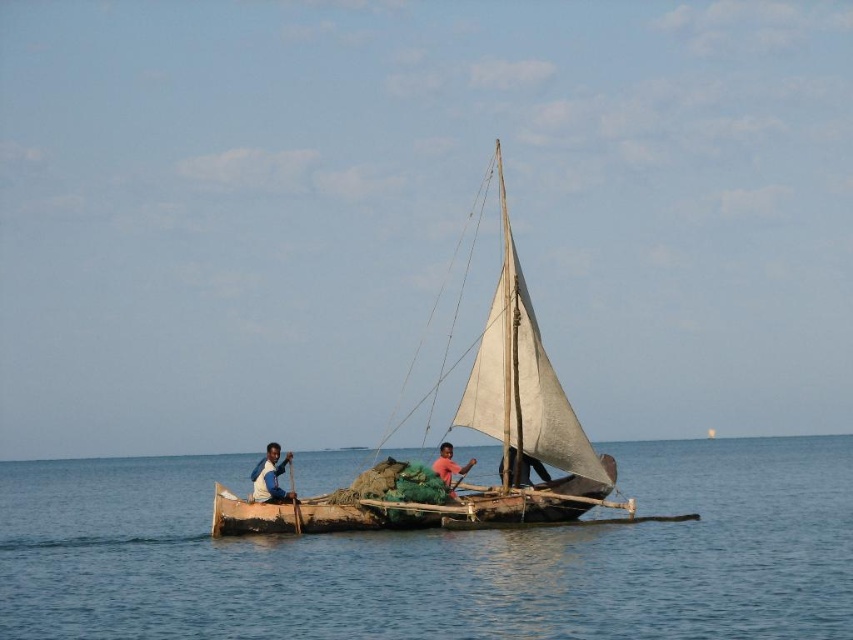
Between wooden canoe at center and blue fabric shirt at center, which one has more height?

wooden canoe at center is taller.

Between point (549, 516) and point (270, 465), which one is positioned behind?

Point (270, 465)

Who is more distant from viewer, (271,522) or (274,497)?

The point (274,497) is more distant.

In order to click on wooden canoe at center in this screenshot , I will do `click(424, 512)`.

I want to click on white canvas sailboat at center, so click(x=473, y=429).

Describe the element at coordinates (473, 429) in the screenshot. I see `white canvas sailboat at center` at that location.

Find the location of a particular element. white canvas sailboat at center is located at coordinates (473, 429).

Is dark blue fabric sail at center bigger than dark skin human at center?

Incorrect, dark blue fabric sail at center is not larger than dark skin human at center.

The height and width of the screenshot is (640, 853). In order to click on dark blue fabric sail at center in this screenshot , I will do `click(524, 468)`.